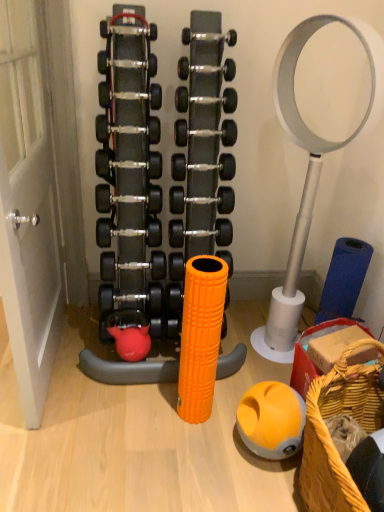
Question: In the image, is black rubber dumbbell at center, the fifth dumbbell positioned from the bottom, positioned in front of or behind black rubber dumbbell at center, which ranks as the seventh dumbbell in top-to-bottom order?

Choices:
 (A) behind
 (B) front

Answer: (B)

Question: Does point (178, 164) appear closer or farther from the camera than point (230, 209)?

Choices:
 (A) farther
 (B) closer

Answer: (A)

Question: Considering the real-world distances, which object is closest to the orange rubber ball at lower center?

Choices:
 (A) silver metallic dumbbell at center, positioned as the sixth dumbbell in bottom-to-top order
 (B) silver metallic dumbbell at center, the first dumbbell positioned from the top
 (C) silver metallic dumbbell at center, which ranks as the 8th dumbbell in bottom-to-top order
 (D) black rubber dumbbell at center, placed as the 5th dumbbell when sorted from top to bottom
 (E) black rubber dumbbell at center, which ranks as the eighth dumbbell in top-to-bottom order

Answer: (D)

Question: Which of these objects is positioned farthest from the black rubber dumbbell at center, which ranks as the seventh dumbbell in top-to-bottom order?

Choices:
 (A) woven straw basket at lower right
 (B) black rubber dumbbell at center, which ranks as the eighth dumbbell in top-to-bottom order
 (C) silver metallic dumbbell at center, the first dumbbell positioned from the top
 (D) silver metallic dumbbell at center, positioned as the sixth dumbbell in bottom-to-top order
 (E) silver metallic dumbbell at center, the second dumbbell when ordered from top to bottom

Answer: (A)